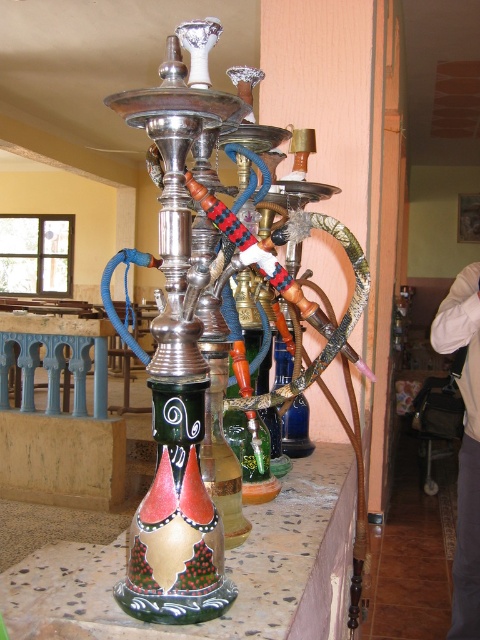
Based on the photo, please construct a question and answer based on the provided information. Ensure the question adheres to the rules outlined above. The answer should utilize the coordinates from the Objects Description to determine the position of the painted ceramic hookah at center relative to the scene.

The painted ceramic hookah at center is located at coordinates point (226, 570), which places it near the lower right of the scene.

You are a customer in a lounge area and want to pick up an item from the countertop. There are two points marked on the image where items are placed. The first point is at coordinates point (269, 568) and the second is at point (472, 570). Which point is closer to you so you can reach it easily?

Point (269, 568) is closer to the camera than point (472, 570), so you can reach it easily.

You are a customer at a hookah lounge and want to order a drink. You see the painted ceramic hookah at center and the white fabric shirt at upper right. Which object is closer to the left side of the image?

The painted ceramic hookah at center is to the left of the white fabric shirt at upper right, so it is closer to the left side of the image.